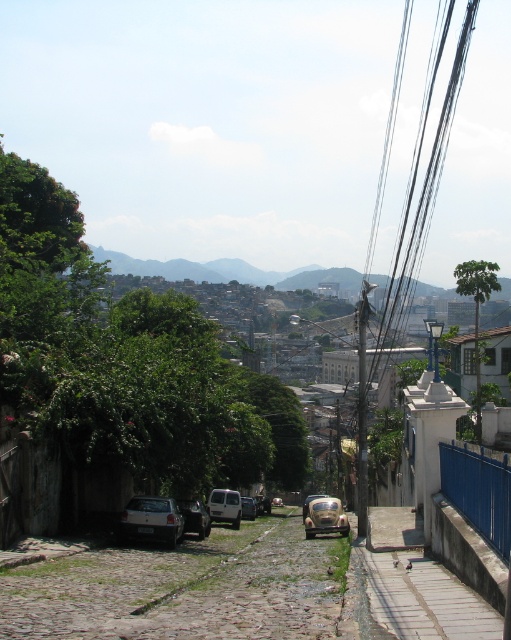
Question: Observing the image, what is the correct spatial positioning of metallic silver van at center in reference to gold metallic car at center?

Choices:
 (A) above
 (B) below

Answer: (A)

Question: Can you confirm if black wire at upper right is smaller than shiny silver car at center?

Choices:
 (A) yes
 (B) no

Answer: (B)

Question: Which of the following is the farthest from the observer?

Choices:
 (A) (313, 496)
 (B) (144, 522)

Answer: (A)

Question: Does gold metallic car at center appear on the right side of shiny silver car at center?

Choices:
 (A) yes
 (B) no

Answer: (B)

Question: Among these objects, which one is farthest from the camera?

Choices:
 (A) smooth concrete sidewalk at lower right
 (B) rusty metal car at center
 (C) silver metallic car at lower left

Answer: (B)

Question: Which point is farther to the camera?

Choices:
 (A) (154, 499)
 (B) (304, 516)
 (C) (341, 512)

Answer: (B)